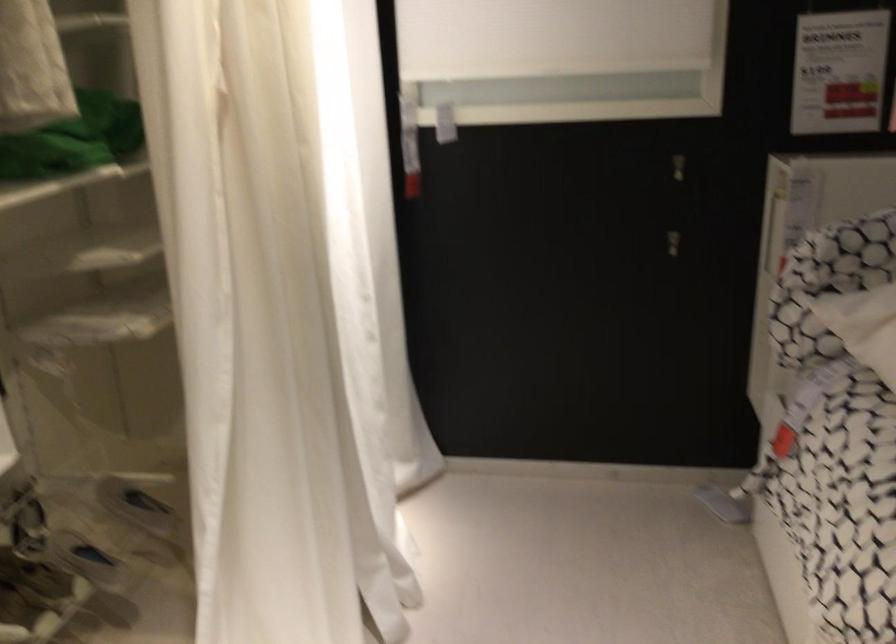
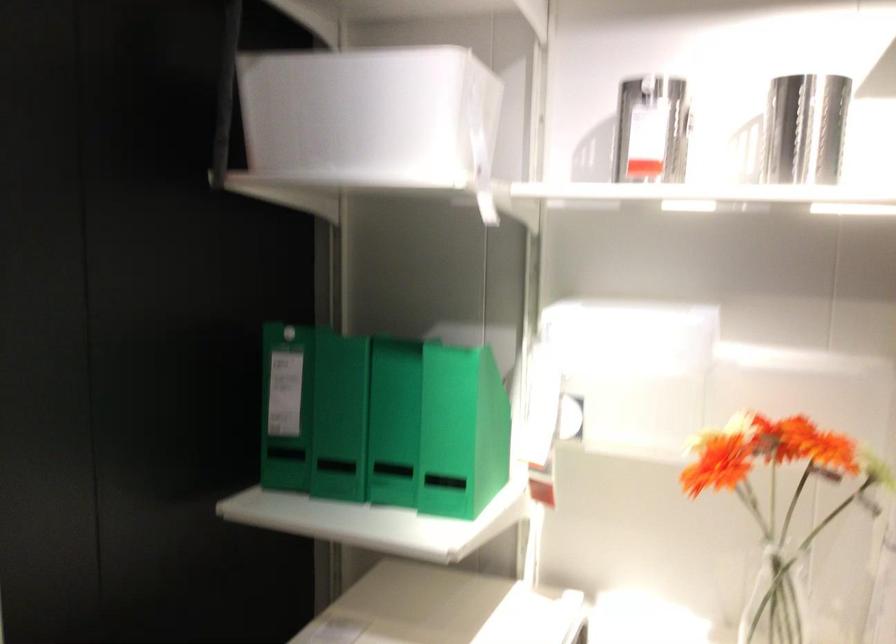
Question: The camera is either moving clockwise (left) or counter-clockwise (right) around the object. The first image is from the beginning of the video and the second image is from the end. Is the camera moving left or right when shooting the video?

Choices:
 (A) Left
 (B) Right

Answer: (B)